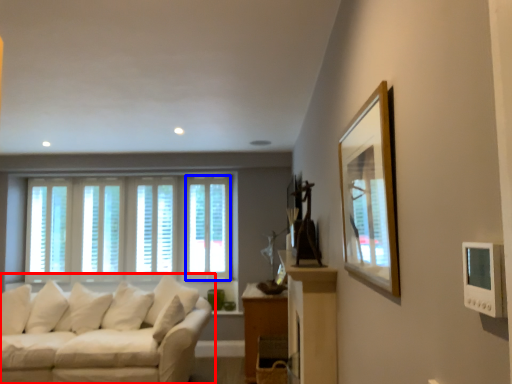
Question: Which object is further to the camera taking this photo, studio couch (highlighted by a red box) or window (highlighted by a blue box)?

Choices:
 (A) studio couch
 (B) window

Answer: (B)